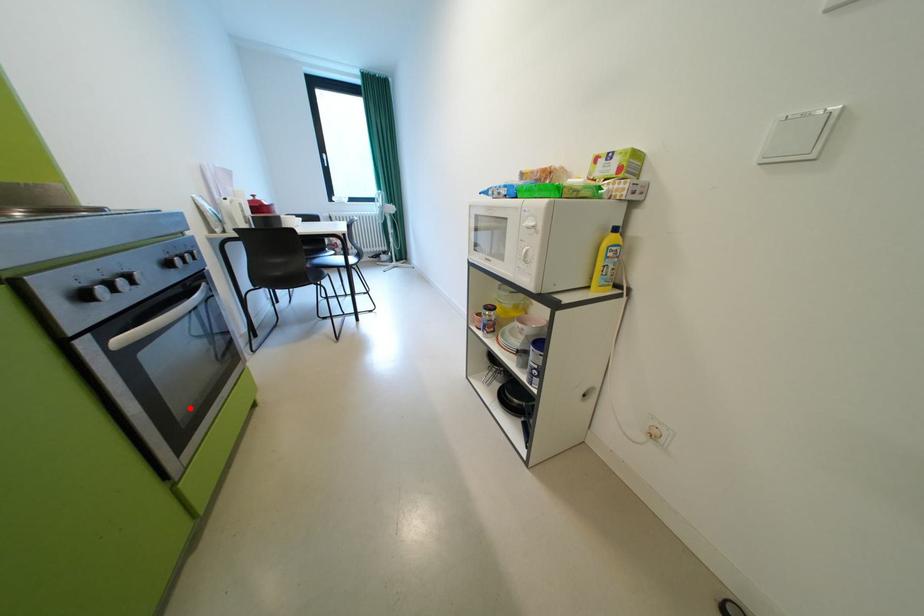
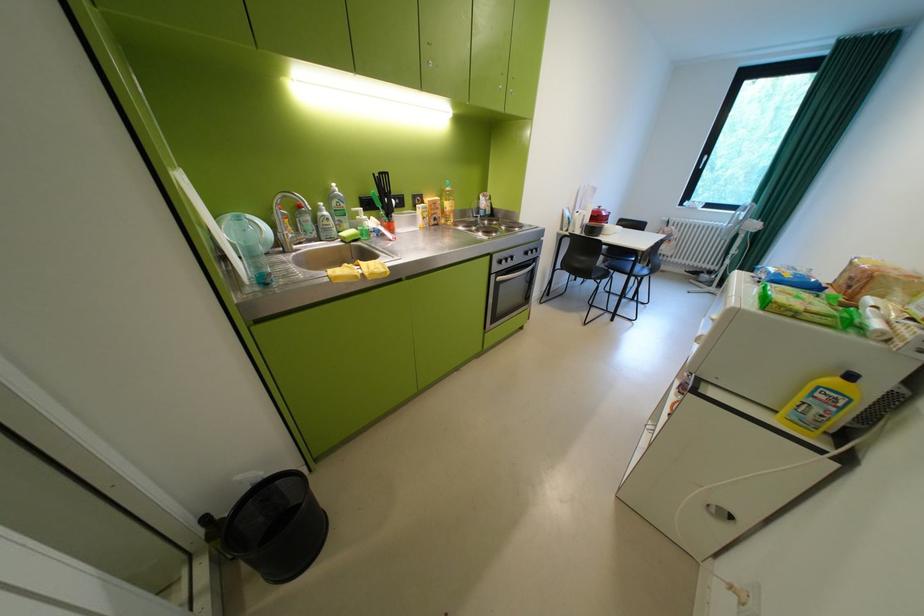
Question: I am providing you with two images of the same scene from different viewpoints. A red point is marked on the first image. At the location where the point appears in image 1, is it still visible in image 2?

Choices:
 (A) Yes
 (B) No

Answer: (A)